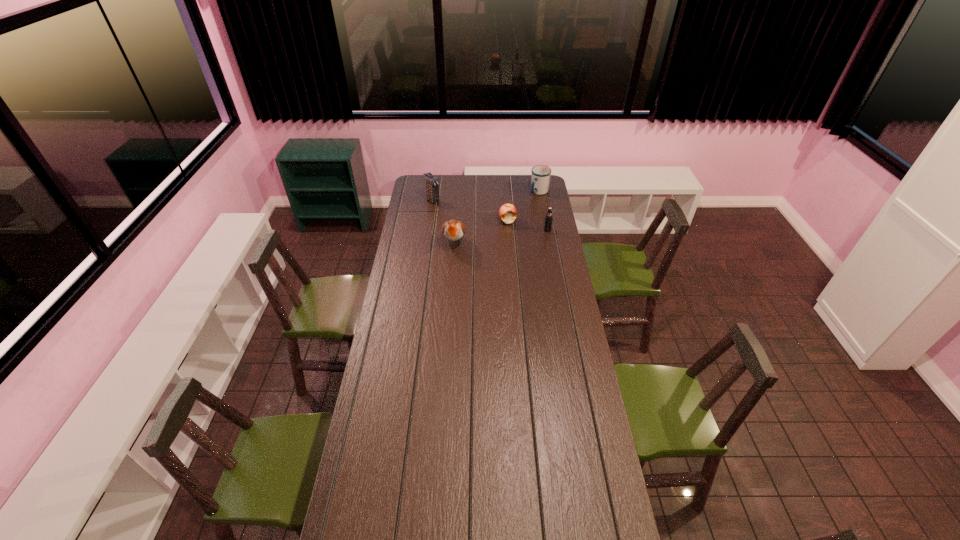
Find the location of a particular element. Image resolution: width=960 pixels, height=540 pixels. free spot located 0.200m on the handle side of the mug is located at coordinates (522, 214).

This screenshot has height=540, width=960. I want to click on vacant area located 0.270m on the bitten side of the third object from left to right, so click(476, 249).

Identify the location of vacant area situated on the bitten side of the third object from left to right. (492, 234).

At what (x,y) coordinates should I click in order to perform the action: click on vacant space located 0.070m on the bitten side of the third object from left to right. Please return your answer as a coordinate pair (x, y). This screenshot has width=960, height=540. Looking at the image, I should click on (496, 231).

Where is `vacant space situated with the zip open on the leftmost object`? The width and height of the screenshot is (960, 540). vacant space situated with the zip open on the leftmost object is located at coordinates (470, 225).

Locate an element on the screen. Image resolution: width=960 pixels, height=540 pixels. vacant space located with the zip open on the leftmost object is located at coordinates (446, 210).

At what (x,y) coordinates should I click in order to perform the action: click on vacant space situated 0.230m with the zip open on the leftmost object. Please return your answer as a coordinate pair (x, y). This screenshot has width=960, height=540. Looking at the image, I should click on (462, 219).

Where is `object that is at the far edge`? Image resolution: width=960 pixels, height=540 pixels. object that is at the far edge is located at coordinates (540, 177).

Identify the location of object present at the left edge. (431, 182).

This screenshot has height=540, width=960. Find the location of `pop at the right edge`. pop at the right edge is located at coordinates click(x=548, y=219).